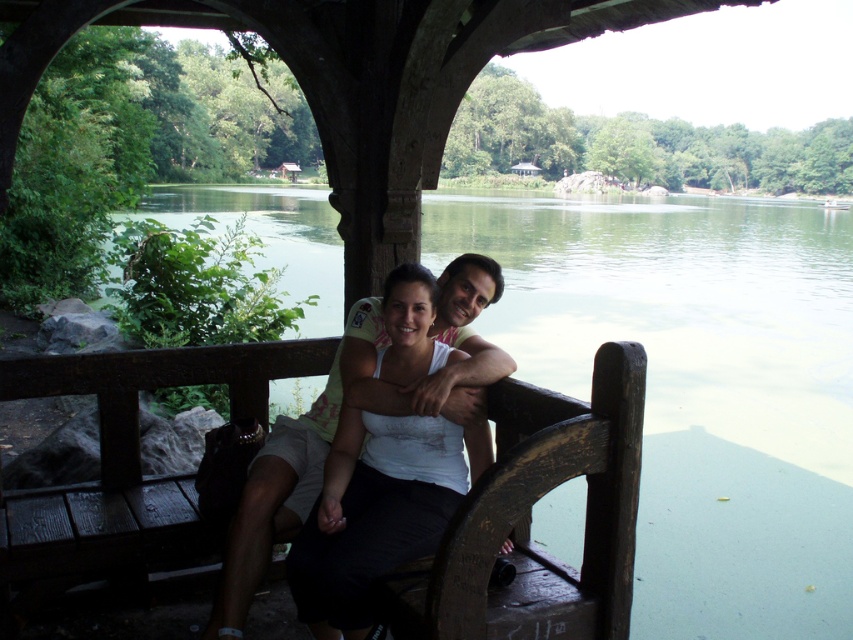
Question: Is wooden bench at center behind white matte tank top at center?

Choices:
 (A) yes
 (B) no

Answer: (A)

Question: Which of the following is the closest to the observer?

Choices:
 (A) (634, 410)
 (B) (322, 573)

Answer: (A)

Question: Can you confirm if wooden bench at center is positioned to the left of white matte tank top at center?

Choices:
 (A) no
 (B) yes

Answer: (B)

Question: Considering the relative positions of wooden bench at center and white matte tank top at center in the image provided, where is wooden bench at center located with respect to white matte tank top at center?

Choices:
 (A) above
 (B) below

Answer: (A)

Question: Which point is closer to the camera?

Choices:
 (A) white matte tank top at center
 (B) wooden bench at center

Answer: (A)